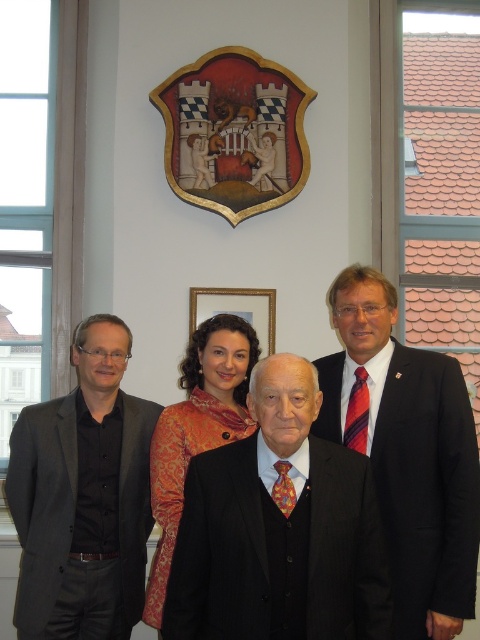
You are standing in front of the group and want to hand a document to the person wearing the black pinstripe suit at center. Considering the distance, can you reach them without moving closer?

The black pinstripe suit at center is 8.05 feet away from viewer, so you cannot reach them without moving closer as the distance is too far for a typical arm reach.

You are a photographer setting up for a group photo. You need to position the matte black suit at right and the wooden shield at upper center so that they are exactly 2 meters apart. Based on the current setup, do you need to move them closer or farther apart?

The matte black suit at right is currently 1.76 meters from the wooden shield at upper center, which is less than 2 meters. Therefore, you need to move them farther apart to reach the desired distance.

Based on the scene description, where is the black pinstripe suit at center located in terms of coordinates?

The black pinstripe suit at center is located at coordinates point (208,540).